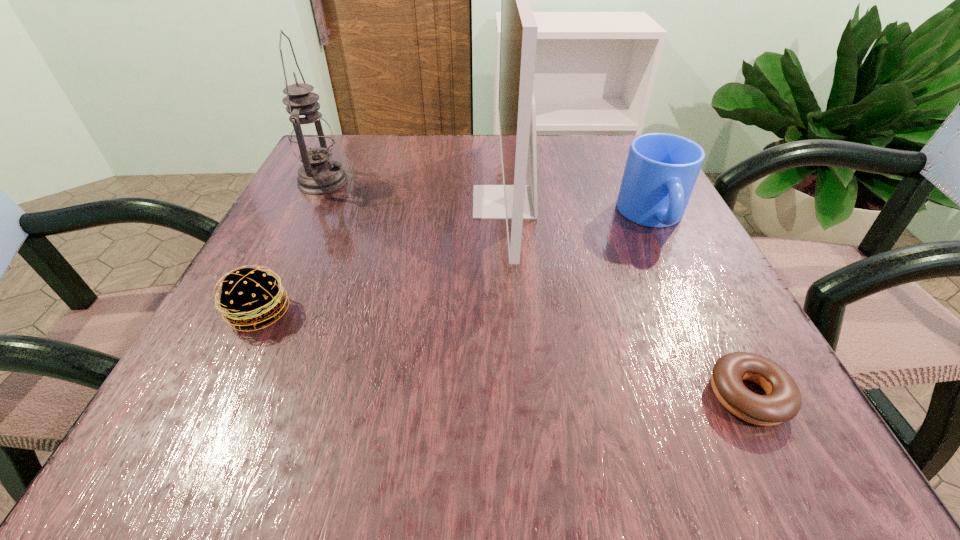
Where is `the tallest object`? The image size is (960, 540). the tallest object is located at coordinates (514, 201).

At what (x,y) coordinates should I click in order to perform the action: click on monitor. Please return your answer as a coordinate pair (x, y). The width and height of the screenshot is (960, 540). Looking at the image, I should click on (514, 201).

Locate an element on the screen. The width and height of the screenshot is (960, 540). oil lamp is located at coordinates (311, 139).

Find the location of a particular element. The height and width of the screenshot is (540, 960). the third shortest object is located at coordinates (661, 170).

Where is `the fourth tallest object`? Image resolution: width=960 pixels, height=540 pixels. the fourth tallest object is located at coordinates (252, 298).

Find the location of a particular element. This screenshot has height=540, width=960. the nearest object is located at coordinates (783, 401).

Find the location of a particular element. This screenshot has height=540, width=960. doughnut is located at coordinates (783, 401).

Find the location of a particular element. vacant space situated 0.250m on the front-facing side of the monitor is located at coordinates (345, 202).

This screenshot has height=540, width=960. I want to click on vacant space located on the front-facing side of the monitor, so click(x=329, y=202).

Identify the location of vacant space located 0.100m on the front-facing side of the monitor. The width and height of the screenshot is (960, 540). (422, 202).